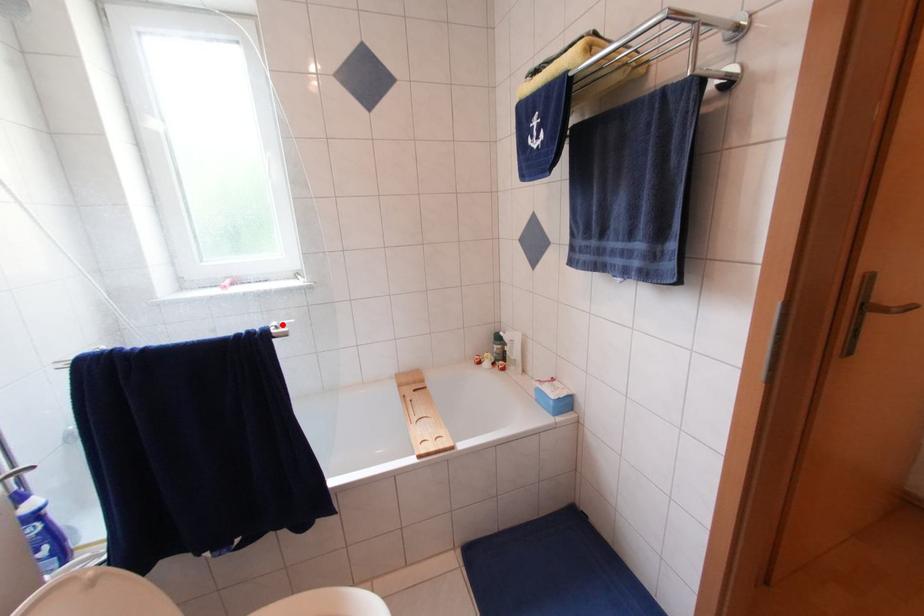
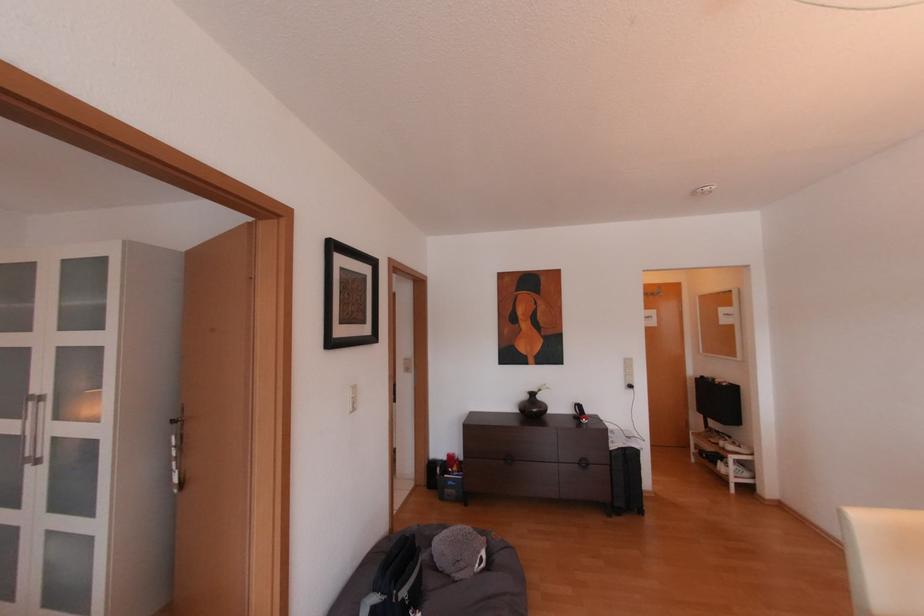
Question: I am providing you with two images of the same scene from different viewpoints. A red point is marked on the first image. Is the red point's position out of view in image 2?

Choices:
 (A) Yes
 (B) No

Answer: (A)